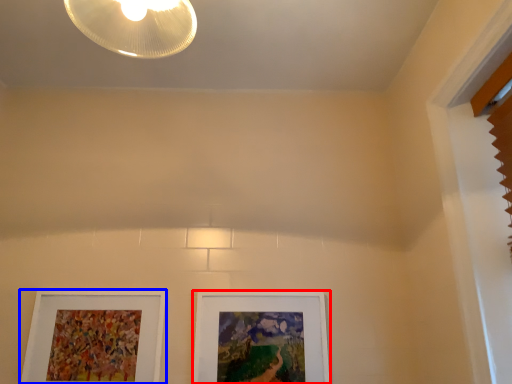
Question: Which object appears closest to the camera in this image, picture frame (highlighted by a red box) or picture frame (highlighted by a blue box)?

Choices:
 (A) picture frame
 (B) picture frame

Answer: (B)